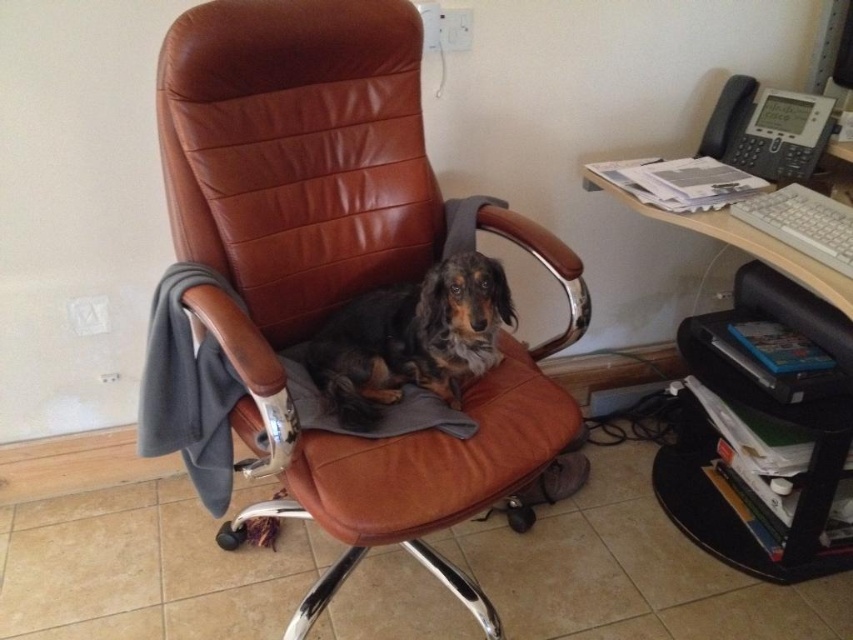
What do you see at coordinates (338, 264) in the screenshot? I see `brown leather swivel chair at center` at bounding box center [338, 264].

Looking at this image, who is positioned more to the left, brown leather swivel chair at center or black plastic computer desk at right?

From the viewer's perspective, brown leather swivel chair at center appears more on the left side.

Find the location of a particular element. brown leather swivel chair at center is located at coordinates (338, 264).

Locate an element on the screen. The image size is (853, 640). brown leather swivel chair at center is located at coordinates (338, 264).

Who is positioned more to the right, black plastic computer desk at right or black leather dog at center?

black plastic computer desk at right

Is black plastic computer desk at right to the right of black leather dog at center from the viewer's perspective?

Yes, black plastic computer desk at right is to the right of black leather dog at center.

Which is behind, point (805, 552) or point (477, 300)?

Positioned behind is point (805, 552).

In order to click on black plastic computer desk at right in this screenshot , I will do `click(758, 412)`.

Is brown leather swivel chair at center to the left of black leather dog at center from the viewer's perspective?

Indeed, brown leather swivel chair at center is positioned on the left side of black leather dog at center.

Is brown leather swivel chair at center positioned behind black leather dog at center?

No, brown leather swivel chair at center is in front of black leather dog at center.

Who is more distant from viewer, (x=167, y=99) or (x=427, y=285)?

Point (x=427, y=285)

This screenshot has height=640, width=853. What are the coordinates of `brown leather swivel chair at center` in the screenshot? It's located at point(338,264).